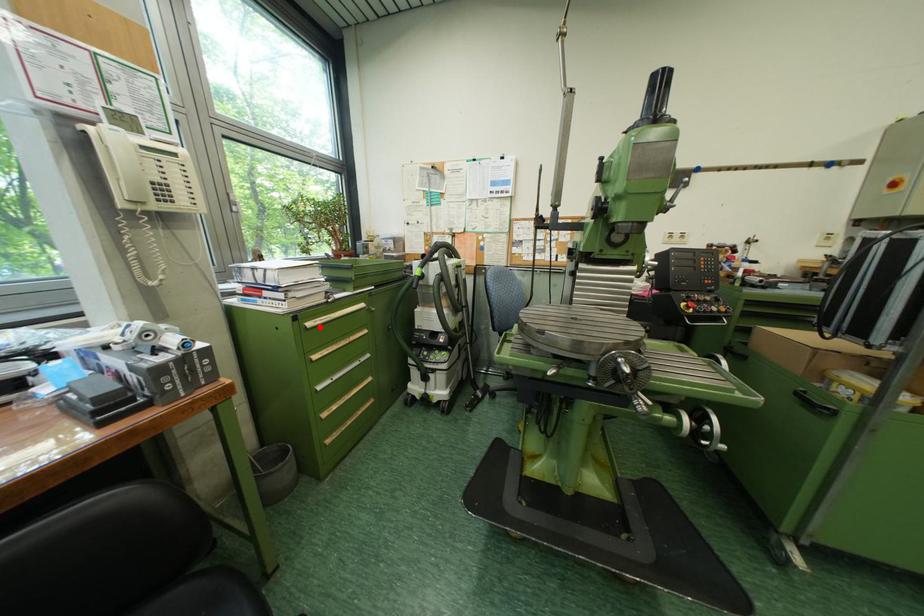
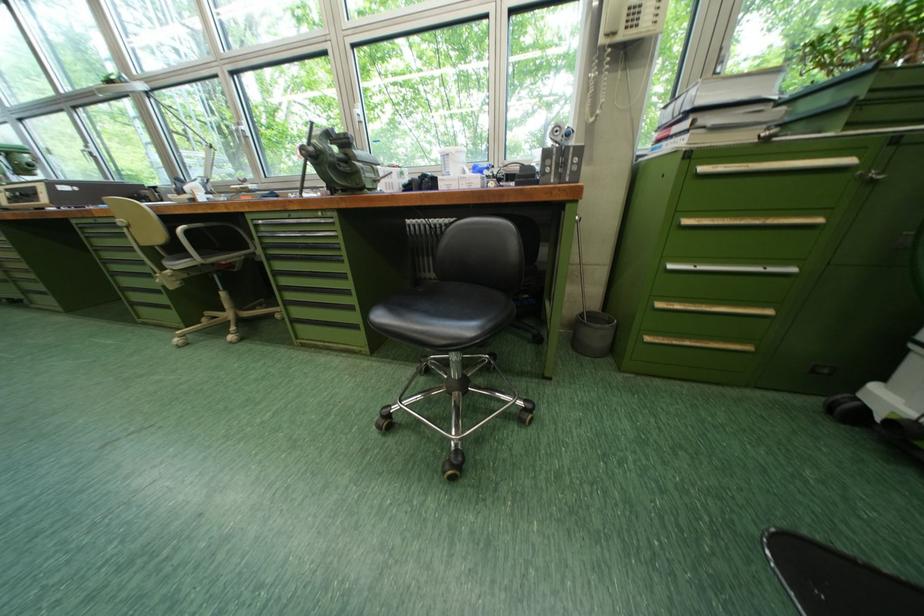
In the second image, find the point that corresponds to the highlighted location in the first image.

(713, 169)